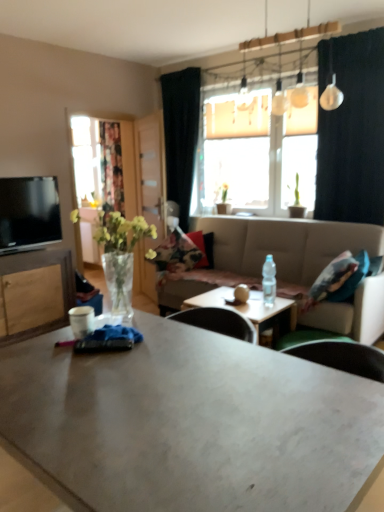
The height and width of the screenshot is (512, 384). I want to click on free spot to the left of clear plastic bottle at center, so click(x=254, y=304).